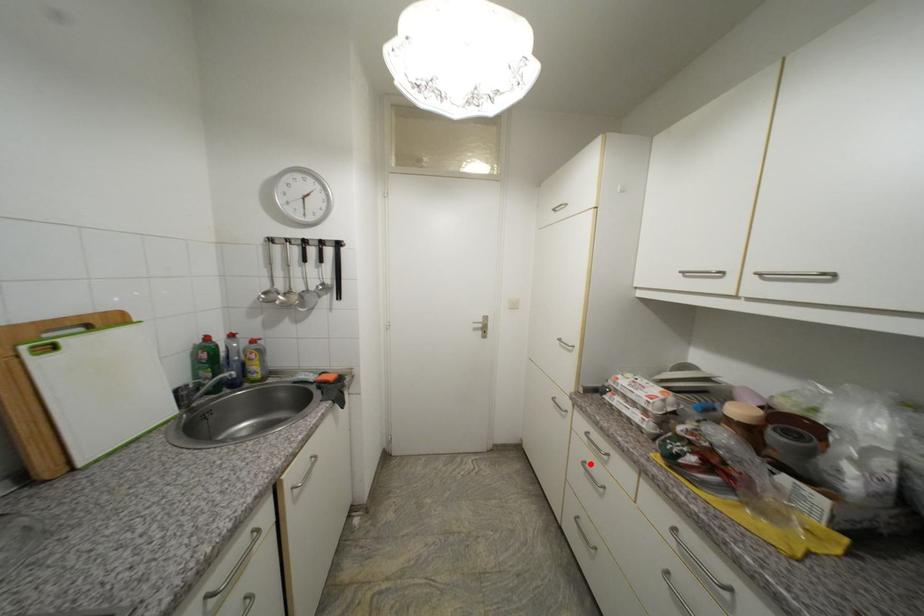
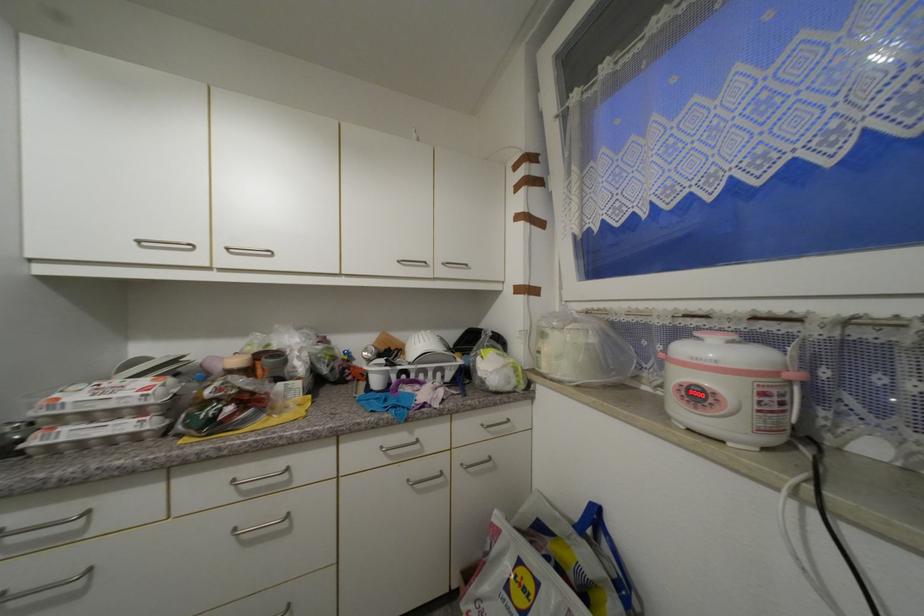
Question: I am providing you with two images of the same scene from different viewpoints. Image1 has a red point marked. In image2, the corresponding 3D location appears at what relative position? Reply with the corresponding letter.

Choices:
 (A) Closer
 (B) Farther

Answer: (A)